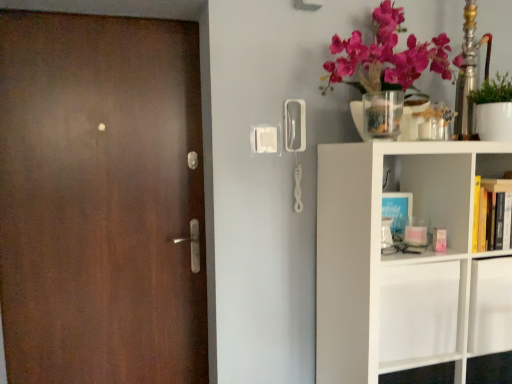
Find the location of a particular element. The image size is (512, 384). vacant area on top of matte brown door at left (from a real-world perspective) is located at coordinates (90, 11).